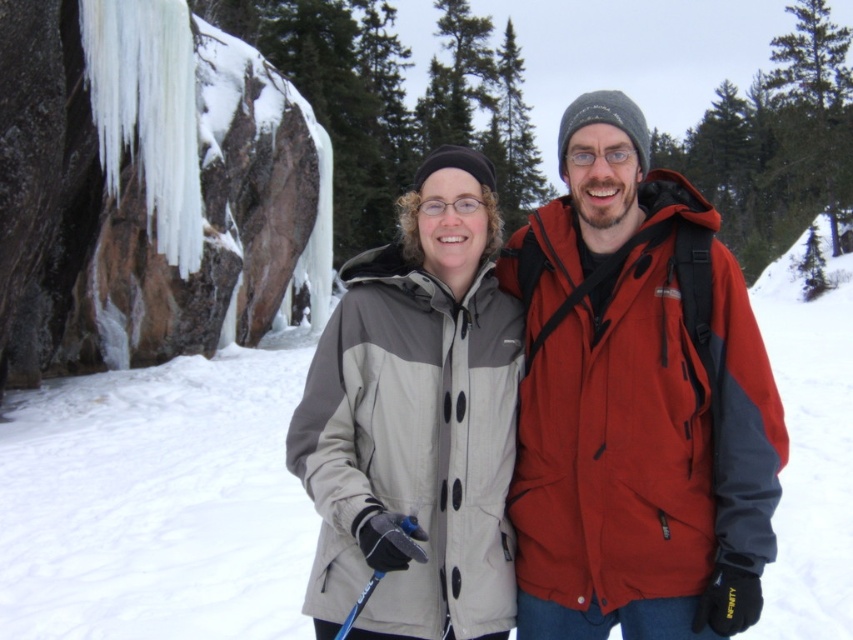
Is matte red jacket at center shorter than gray matte jacket at center?

No, matte red jacket at center is not shorter than gray matte jacket at center.

Is matte red jacket at center thinner than gray matte jacket at center?

Incorrect, matte red jacket at center's width is not less than gray matte jacket at center's.

What do you see at coordinates (635, 404) in the screenshot?
I see `matte red jacket at center` at bounding box center [635, 404].

The image size is (853, 640). Identify the location of matte red jacket at center. (635, 404).

Between point (583, 428) and point (126, 584), which one is positioned behind?

Point (126, 584)

Does matte red jacket at center appear under white fluffy snow at center?

No.

Image resolution: width=853 pixels, height=640 pixels. Find the location of `matte red jacket at center`. matte red jacket at center is located at coordinates click(635, 404).

Locate an element on the screen. The width and height of the screenshot is (853, 640). matte red jacket at center is located at coordinates (635, 404).

Is point (509, 276) positioned before point (363, 604)?

No, it is behind (363, 604).

Based on the photo, is matte red jacket at center shorter than blue plastic ski pole at lower center?

No.

The image size is (853, 640). In order to click on matte red jacket at center in this screenshot , I will do `click(635, 404)`.